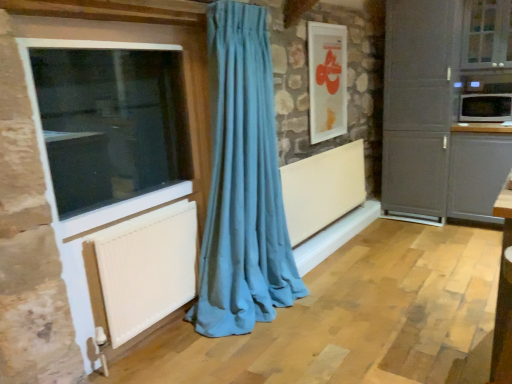
I want to click on vacant area that is in front of teal fabric curtain at center, so click(254, 358).